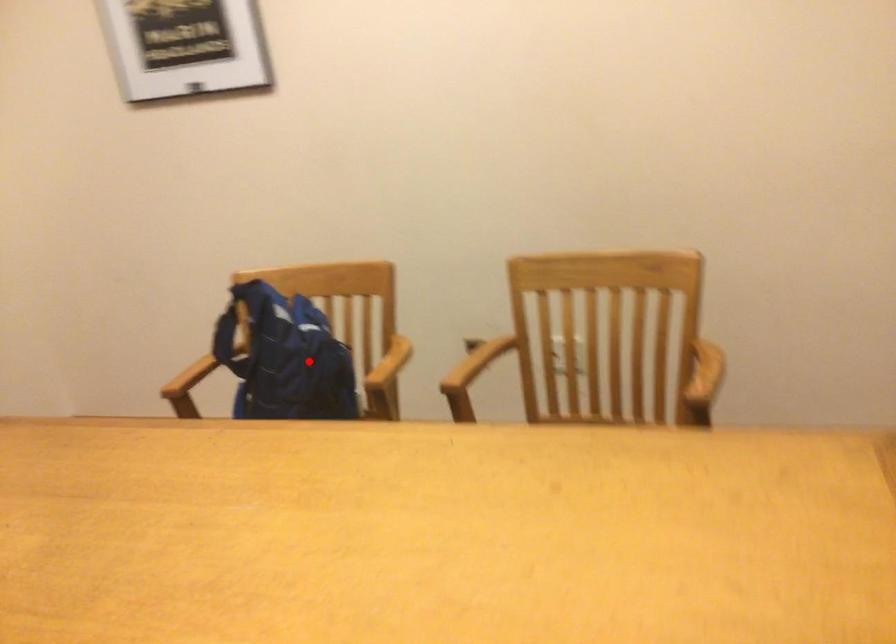
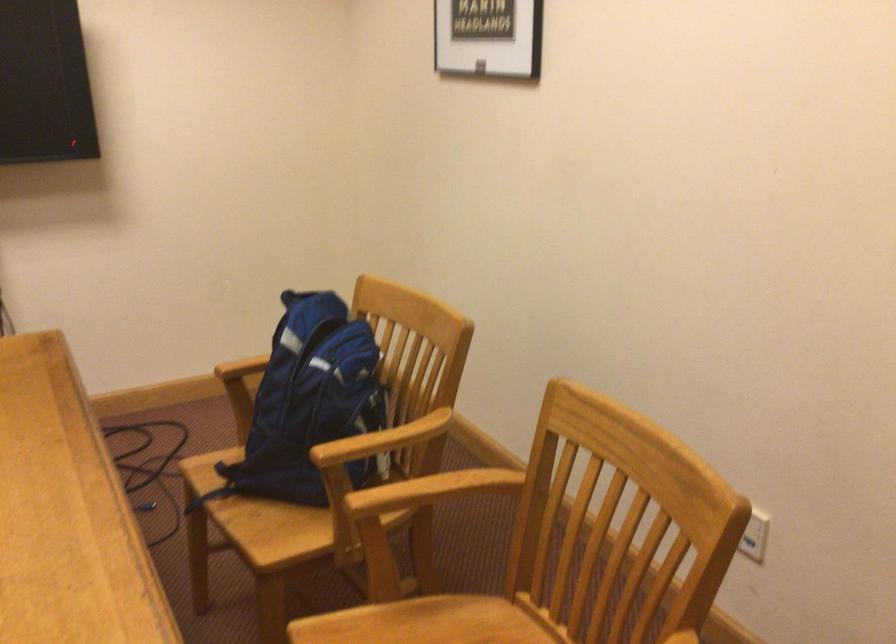
Where in the second image is the point corresponding to the highlighted location from the first image?

(309, 404)